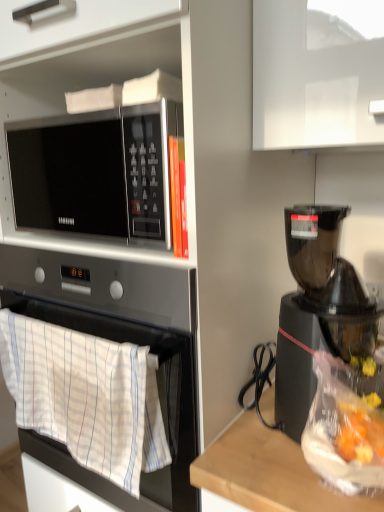
You are a GUI agent. You are given a task and a screenshot of the screen. Output one action in this format:
    pyautogui.click(x=<x>, y=<y>)
    Task: Click on the white cotton towel at lower left
    Image resolution: width=384 pixels, height=512 pixels.
    Given the screenshot: What is the action you would take?
    pyautogui.click(x=123, y=334)

Find the location of a particular element. The width and height of the screenshot is (384, 512). black plastic coffee maker at right is located at coordinates (318, 311).

Who is shorter, black plastic coffee maker at right or white cotton towel at lower left?

white cotton towel at lower left is shorter.

Where is `coffee maker above the white cotton towel at lower left (from the image's perspective)`? coffee maker above the white cotton towel at lower left (from the image's perspective) is located at coordinates (318, 311).

Does black plastic coffee maker at right contain white cotton towel at lower left?

→ No, white cotton towel at lower left is not a part of black plastic coffee maker at right.

Are black plastic coffee maker at right and white cotton towel at lower left far apart?

No.

In the image, is white cotton towel at lower left on the left side or the right side of sleek silver microwave at upper left?

Clearly, white cotton towel at lower left is on the left of sleek silver microwave at upper left in the image.

From a real-world perspective, who is located higher, white cotton towel at lower left or sleek silver microwave at upper left?

sleek silver microwave at upper left.

This screenshot has height=512, width=384. Identify the location of oven in front of the sleek silver microwave at upper left. (123, 334).

Is white cotton towel at lower left smaller than sleek silver microwave at upper left?

Correct, white cotton towel at lower left occupies less space than sleek silver microwave at upper left.

From the picture: Which object is thinner, white cotton towel at lower left or black plastic coffee maker at right?

white cotton towel at lower left is thinner.

Between white cotton towel at lower left and black plastic coffee maker at right, which one appears on the right side from the viewer's perspective?

black plastic coffee maker at right.

Is white cotton towel at lower left facing away from black plastic coffee maker at right?

No, white cotton towel at lower left is not facing away from black plastic coffee maker at right.

Is white cotton towel at lower left further to camera compared to black plastic coffee maker at right?

Yes.

From the picture: Is sleek silver microwave at upper left turned away from white cotton towel at lower left?

No, sleek silver microwave at upper left is not facing away from white cotton towel at lower left.

Are sleek silver microwave at upper left and white cotton towel at lower left beside each other?

No, sleek silver microwave at upper left is not touching white cotton towel at lower left.

Measure the distance between sleek silver microwave at upper left and white cotton towel at lower left.

sleek silver microwave at upper left is 8.34 inches away from white cotton towel at lower left.

Who is smaller, sleek silver microwave at upper left or white cotton towel at lower left?

white cotton towel at lower left is smaller.

Is sleek silver microwave at upper left in contact with black plastic coffee maker at right?

sleek silver microwave at upper left and black plastic coffee maker at right are clearly separated.

From the image's perspective, is sleek silver microwave at upper left positioned above or below black plastic coffee maker at right?

From the image's perspective, sleek silver microwave at upper left appears above black plastic coffee maker at right.

Is sleek silver microwave at upper left positioned in front of black plastic coffee maker at right?

No, sleek silver microwave at upper left is further to the viewer.

Who is smaller, black plastic coffee maker at right or sleek silver microwave at upper left?

With smaller size is sleek silver microwave at upper left.

Is black plastic coffee maker at right with sleek silver microwave at upper left?

No, black plastic coffee maker at right is not making contact with sleek silver microwave at upper left.

Which object is further away from the camera taking this photo, black plastic coffee maker at right or sleek silver microwave at upper left?

sleek silver microwave at upper left.

Between point (323, 323) and point (100, 165), which one is positioned behind?

Positioned behind is point (100, 165).

I want to click on coffee maker above the white cotton towel at lower left (from the image's perspective), so coord(318,311).

The height and width of the screenshot is (512, 384). I want to click on microwave oven that appears above the white cotton towel at lower left (from a real-world perspective), so click(x=96, y=172).

From the image, which object appears to be farther from white cotton towel at lower left, sleek silver microwave at upper left or black plastic coffee maker at right?

The object further to white cotton towel at lower left is black plastic coffee maker at right.

Looking at this image, based on their spatial positions, is black plastic coffee maker at right or white cotton towel at lower left further from sleek silver microwave at upper left?

black plastic coffee maker at right.

Estimate the real-world distances between objects in this image. Which object is further from sleek silver microwave at upper left, white cotton towel at lower left or black plastic coffee maker at right?

black plastic coffee maker at right is further to sleek silver microwave at upper left.

Based on their spatial positions, is sleek silver microwave at upper left or white cotton towel at lower left closer to black plastic coffee maker at right?

Among the two, white cotton towel at lower left is located nearer to black plastic coffee maker at right.

When comparing their distances from white cotton towel at lower left, does black plastic coffee maker at right or sleek silver microwave at upper left seem further?

Based on the image, black plastic coffee maker at right appears to be further to white cotton towel at lower left.

Based on their spatial positions, is white cotton towel at lower left or sleek silver microwave at upper left further from black plastic coffee maker at right?

Among the two, sleek silver microwave at upper left is located further to black plastic coffee maker at right.

Identify the location of microwave oven between white cotton towel at lower left and black plastic coffee maker at right in the horizontal direction. (96, 172).